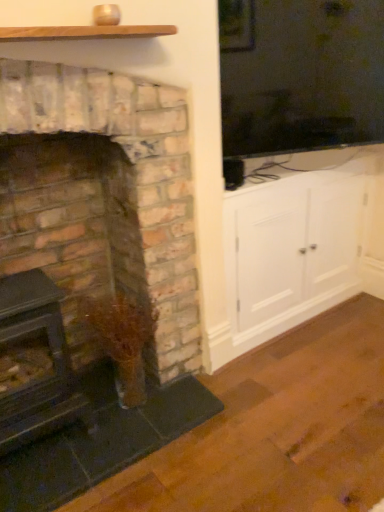
What do you see at coordinates (71, 223) in the screenshot? The width and height of the screenshot is (384, 512). I see `rustic brick fireplace at left, which appears as the 1th fireplace when viewed from the left` at bounding box center [71, 223].

What do you see at coordinates (100, 261) in the screenshot?
I see `rustic brick fireplace at left, the second fireplace in the left-to-right sequence` at bounding box center [100, 261].

In order to click on white wood cabinet at right in this screenshot , I will do `click(292, 242)`.

This screenshot has width=384, height=512. Describe the element at coordinates (292, 242) in the screenshot. I see `white wood cabinet at right` at that location.

What are the coordinates of `wooden plank at upper center` in the screenshot? It's located at (84, 32).

Considering the relative positions of white wood cabinet at right and rustic brick fireplace at left, placed as the 1th fireplace when sorted from right to left, in the image provided, is white wood cabinet at right in front of rustic brick fireplace at left, placed as the 1th fireplace when sorted from right to left,?

No, it is not.

From the image's perspective, is white wood cabinet at right above or below rustic brick fireplace at left, placed as the 1th fireplace when sorted from right to left?

From the image's perspective, white wood cabinet at right appears above rustic brick fireplace at left, placed as the 1th fireplace when sorted from right to left.

From a real-world perspective, is white wood cabinet at right on top of rustic brick fireplace at left, placed as the 1th fireplace when sorted from right to left?

No.

Is white wood cabinet at right oriented away from rustic brick fireplace at left, the second fireplace in the left-to-right sequence?

No, rustic brick fireplace at left, the second fireplace in the left-to-right sequence, is not at the back of white wood cabinet at right.

Would you say rustic brick fireplace at left, placed as the 1th fireplace when sorted from right to left, contains white wood cabinet at right?

No, white wood cabinet at right is not inside rustic brick fireplace at left, placed as the 1th fireplace when sorted from right to left.

Between point (39, 268) and point (237, 303), which one is positioned behind?

The point (237, 303) is more distant.

Considering the positions of objects rustic brick fireplace at left, the second fireplace in the left-to-right sequence, and white wood cabinet at right in the image provided, who is behind, rustic brick fireplace at left, the second fireplace in the left-to-right sequence, or white wood cabinet at right?

white wood cabinet at right is behind.

Is rustic brick fireplace at left, the second fireplace in the left-to-right sequence, aimed at white wood cabinet at right?

No, rustic brick fireplace at left, the second fireplace in the left-to-right sequence, does not turn towards white wood cabinet at right.

Which object is more forward, wooden plank at upper center or rustic brick fireplace at left, positioned as the 2th fireplace in right-to-left order?

wooden plank at upper center.

Is wooden plank at upper center positioned far away from rustic brick fireplace at left, positioned as the 2th fireplace in right-to-left order?

No, wooden plank at upper center is not far from rustic brick fireplace at left, positioned as the 2th fireplace in right-to-left order.

Is wooden plank at upper center situated inside rustic brick fireplace at left, which appears as the 1th fireplace when viewed from the left, or outside?

wooden plank at upper center cannot be found inside rustic brick fireplace at left, which appears as the 1th fireplace when viewed from the left.

Can you confirm if rustic brick fireplace at left, which appears as the 1th fireplace when viewed from the left, is smaller than white wood cabinet at right?

Yes, rustic brick fireplace at left, which appears as the 1th fireplace when viewed from the left, is smaller than white wood cabinet at right.

Considering the relative sizes of rustic brick fireplace at left, positioned as the 2th fireplace in right-to-left order, and white wood cabinet at right in the image provided, is rustic brick fireplace at left, positioned as the 2th fireplace in right-to-left order, taller than white wood cabinet at right?

Correct, rustic brick fireplace at left, positioned as the 2th fireplace in right-to-left order, is much taller as white wood cabinet at right.

You are a GUI agent. You are given a task and a screenshot of the screen. Output one action in this format:
    pyautogui.click(x=<x>, y=<y>)
    Task: Click on the entertainment center to the right of rustic brick fireplace at left, which appears as the 1th fireplace when viewed from the left
    The width and height of the screenshot is (384, 512).
    Given the screenshot: What is the action you would take?
    [292, 242]

From a real-world perspective, is rustic brick fireplace at left, which appears as the 1th fireplace when viewed from the left, positioned above or below white wood cabinet at right?

From a real-world perspective, rustic brick fireplace at left, which appears as the 1th fireplace when viewed from the left, is physically above white wood cabinet at right.

Are white wood cabinet at right and wooden plank at upper center beside each other?

No, white wood cabinet at right is not in contact with wooden plank at upper center.

Does white wood cabinet at right contain wooden plank at upper center?

Actually, wooden plank at upper center is outside white wood cabinet at right.

From the image's perspective, does white wood cabinet at right appear lower than wooden plank at upper center?

Yes, from the image's perspective, white wood cabinet at right is below wooden plank at upper center.

Image resolution: width=384 pixels, height=512 pixels. What are the coordinates of `entertainment center behind the wooden plank at upper center` in the screenshot? It's located at (292, 242).

Which point is more forward, (147, 366) or (157, 417)?

Point (157, 417)

Considering the sizes of objects rustic brick fireplace at left, positioned as the 2th fireplace in right-to-left order, and rustic brick fireplace at left, placed as the 1th fireplace when sorted from right to left, in the image provided, who is wider, rustic brick fireplace at left, positioned as the 2th fireplace in right-to-left order, or rustic brick fireplace at left, placed as the 1th fireplace when sorted from right to left,?

rustic brick fireplace at left, placed as the 1th fireplace when sorted from right to left.

Is rustic brick fireplace at left, which appears as the 1th fireplace when viewed from the left, facing away from rustic brick fireplace at left, the second fireplace in the left-to-right sequence?

Yes, rustic brick fireplace at left, the second fireplace in the left-to-right sequence, is at the back of rustic brick fireplace at left, which appears as the 1th fireplace when viewed from the left.

From the image's perspective, is rustic brick fireplace at left, positioned as the 2th fireplace in right-to-left order, above or below rustic brick fireplace at left, placed as the 1th fireplace when sorted from right to left?

From the image's perspective, rustic brick fireplace at left, positioned as the 2th fireplace in right-to-left order, appears below rustic brick fireplace at left, placed as the 1th fireplace when sorted from right to left.

This screenshot has height=512, width=384. Find the location of `entertainment center behind the rustic brick fireplace at left, positioned as the 2th fireplace in right-to-left order`. entertainment center behind the rustic brick fireplace at left, positioned as the 2th fireplace in right-to-left order is located at coordinates (292, 242).

Would you say white wood cabinet at right is outside rustic brick fireplace at left, which appears as the 1th fireplace when viewed from the left?

Absolutely, white wood cabinet at right is external to rustic brick fireplace at left, which appears as the 1th fireplace when viewed from the left.

Between point (246, 254) and point (42, 221), which one is positioned behind?

Positioned behind is point (246, 254).

Can you confirm if white wood cabinet at right is positioned to the left of rustic brick fireplace at left, positioned as the 2th fireplace in right-to-left order?

Incorrect, white wood cabinet at right is not on the left side of rustic brick fireplace at left, positioned as the 2th fireplace in right-to-left order.

In the image, there is a rustic brick fireplace at left, placed as the 1th fireplace when sorted from right to left. Where is `entertainment center below it (from a real-world perspective)`? This screenshot has height=512, width=384. entertainment center below it (from a real-world perspective) is located at coordinates (292, 242).

From a real-world perspective, which fireplace is the 2nd one above the white wood cabinet at right? Please provide its 2D coordinates.

[(100, 261)]

Which object lies nearer to the anchor point rustic brick fireplace at left, which appears as the 1th fireplace when viewed from the left, wooden plank at upper center or rustic brick fireplace at left, the second fireplace in the left-to-right sequence?

rustic brick fireplace at left, the second fireplace in the left-to-right sequence, lies closer to rustic brick fireplace at left, which appears as the 1th fireplace when viewed from the left, than the other object.

When comparing their distances from white wood cabinet at right, does rustic brick fireplace at left, positioned as the 2th fireplace in right-to-left order, or wooden plank at upper center seem closer?

rustic brick fireplace at left, positioned as the 2th fireplace in right-to-left order, is closer to white wood cabinet at right.

Estimate the real-world distances between objects in this image. Which object is further from rustic brick fireplace at left, the second fireplace in the left-to-right sequence, wooden plank at upper center or white wood cabinet at right?

Among the two, wooden plank at upper center is located further to rustic brick fireplace at left, the second fireplace in the left-to-right sequence.

Which object lies nearer to the anchor point wooden plank at upper center, rustic brick fireplace at left, placed as the 1th fireplace when sorted from right to left, or white wood cabinet at right?

Based on the image, rustic brick fireplace at left, placed as the 1th fireplace when sorted from right to left, appears to be nearer to wooden plank at upper center.

Looking at the image, which one is located closer to rustic brick fireplace at left, positioned as the 2th fireplace in right-to-left order, white wood cabinet at right or rustic brick fireplace at left, the second fireplace in the left-to-right sequence?

rustic brick fireplace at left, the second fireplace in the left-to-right sequence, is positioned closer to the anchor rustic brick fireplace at left, positioned as the 2th fireplace in right-to-left order.

Looking at the image, which one is located further to rustic brick fireplace at left, the second fireplace in the left-to-right sequence, white wood cabinet at right or rustic brick fireplace at left, which appears as the 1th fireplace when viewed from the left?

The object further to rustic brick fireplace at left, the second fireplace in the left-to-right sequence, is white wood cabinet at right.

Estimate the real-world distances between objects in this image. Which object is further from rustic brick fireplace at left, placed as the 1th fireplace when sorted from right to left, rustic brick fireplace at left, which appears as the 1th fireplace when viewed from the left, or white wood cabinet at right?

white wood cabinet at right lies further to rustic brick fireplace at left, placed as the 1th fireplace when sorted from right to left, than the other object.

Which object lies further to the anchor point wooden plank at upper center, rustic brick fireplace at left, which appears as the 1th fireplace when viewed from the left, or white wood cabinet at right?

white wood cabinet at right.

This screenshot has height=512, width=384. Find the location of `shelf between rustic brick fireplace at left, placed as the 1th fireplace when sorted from right to left, and white wood cabinet at right, along the z-axis`. shelf between rustic brick fireplace at left, placed as the 1th fireplace when sorted from right to left, and white wood cabinet at right, along the z-axis is located at coordinates (84, 32).

Locate an element on the screen. The image size is (384, 512). fireplace situated between rustic brick fireplace at left, positioned as the 2th fireplace in right-to-left order, and white wood cabinet at right from left to right is located at coordinates (100, 261).

Image resolution: width=384 pixels, height=512 pixels. I want to click on fireplace between wooden plank at upper center and rustic brick fireplace at left, positioned as the 2th fireplace in right-to-left order, in the up-down direction, so click(100, 261).

Where is `shelf between rustic brick fireplace at left, which appears as the 1th fireplace when viewed from the left, and white wood cabinet at right, in the horizontal direction`? This screenshot has width=384, height=512. shelf between rustic brick fireplace at left, which appears as the 1th fireplace when viewed from the left, and white wood cabinet at right, in the horizontal direction is located at coordinates (84, 32).